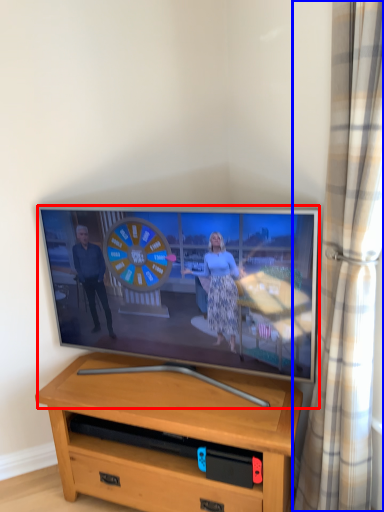
Question: Which point is closer to the camera, television (highlighted by a red box) or curtain (highlighted by a blue box)?

Choices:
 (A) television
 (B) curtain

Answer: (B)